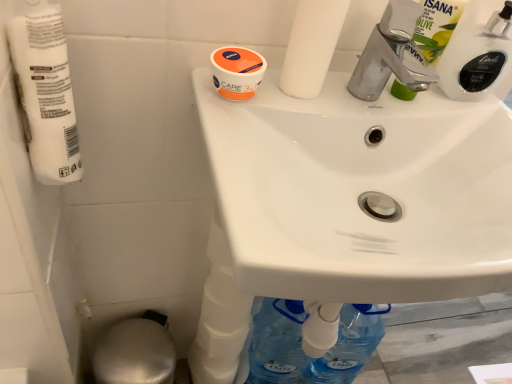
Where is `vacant space that's between orange matte jar at upper center and green plastic bottle at upper right, positioned as the 1th cleaning product in left-to-right order`? vacant space that's between orange matte jar at upper center and green plastic bottle at upper right, positioned as the 1th cleaning product in left-to-right order is located at coordinates (336, 98).